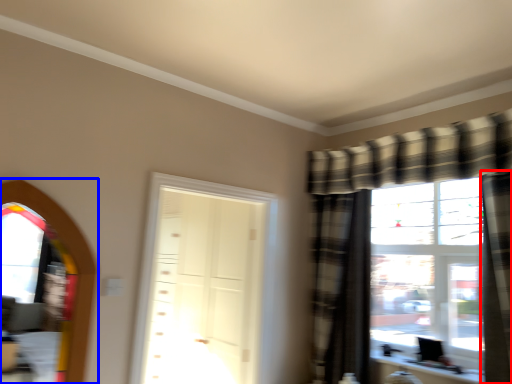
Question: Which of the following is the closest to the observer, curtain (highlighted by a red box) or window screen (highlighted by a blue box)?

Choices:
 (A) curtain
 (B) window screen

Answer: (B)